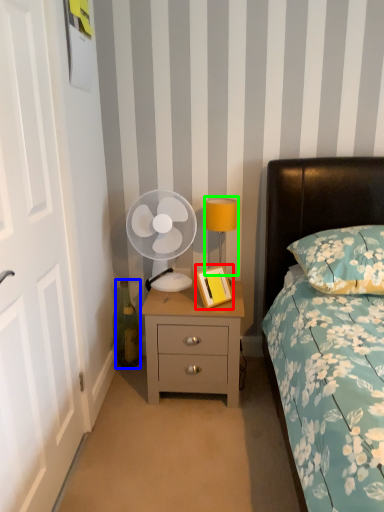
Question: Based on their relative distances, which object is farther from picture frame (highlighted by a red box)? Choose from bottle (highlighted by a blue box) and bedside lamp (highlighted by a green box).

Choices:
 (A) bottle
 (B) bedside lamp

Answer: (A)